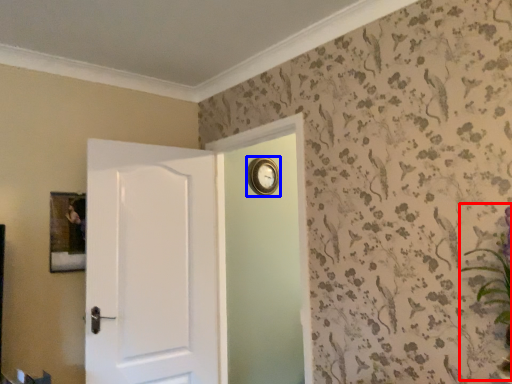
Question: Which object is further to the camera taking this photo, floral arrangement (highlighted by a red box) or clock (highlighted by a blue box)?

Choices:
 (A) floral arrangement
 (B) clock

Answer: (B)